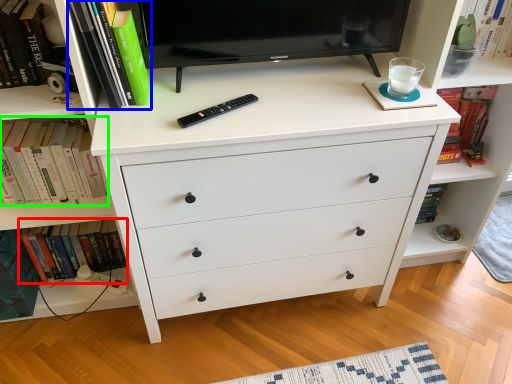
Question: Considering the real-world distances, which object is farthest from book (highlighted by a red box)? book (highlighted by a blue box) or book (highlighted by a green box)?

Choices:
 (A) book
 (B) book

Answer: (A)